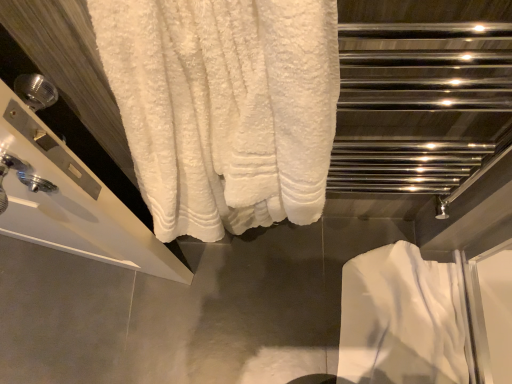
Identify the location of free point below white soft towel at lower right (from a real-world perspective). The image size is (512, 384). (391, 305).